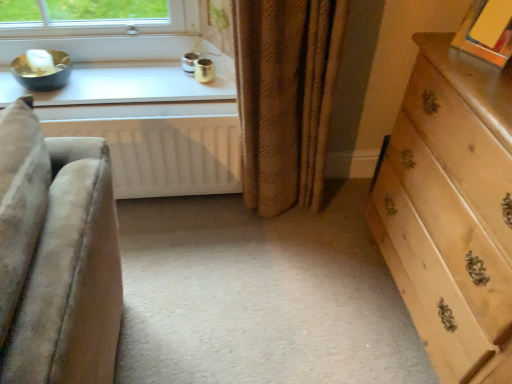
Question: Is light wood dresser at right bigger or smaller than brown textured curtain at center?

Choices:
 (A) big
 (B) small

Answer: (A)

Question: Considering the positions of point (380, 228) and point (264, 87), is point (380, 228) closer or farther from the camera than point (264, 87)?

Choices:
 (A) farther
 (B) closer

Answer: (A)

Question: Estimate the real-world distances between objects in this image. Which object is farther from the light wood dresser at right?

Choices:
 (A) white matte radiator at lower center
 (B) white glossy window sill at upper left
 (C) brown textured curtain at center

Answer: (B)

Question: Which is farther from the white glossy window sill at upper left?

Choices:
 (A) brown textured curtain at center
 (B) white matte radiator at lower center
 (C) light wood dresser at right

Answer: (C)